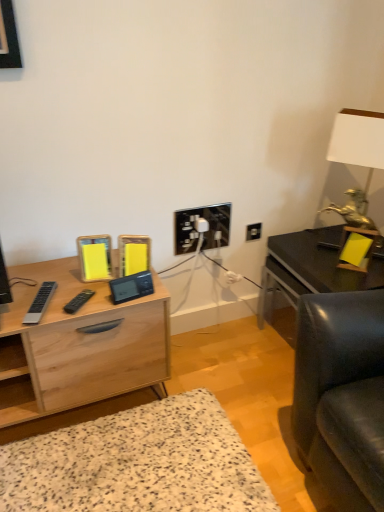
Image resolution: width=384 pixels, height=512 pixels. Find the location of `vacant space to the left of white matte table lamp at upper right`. vacant space to the left of white matte table lamp at upper right is located at coordinates click(x=309, y=248).